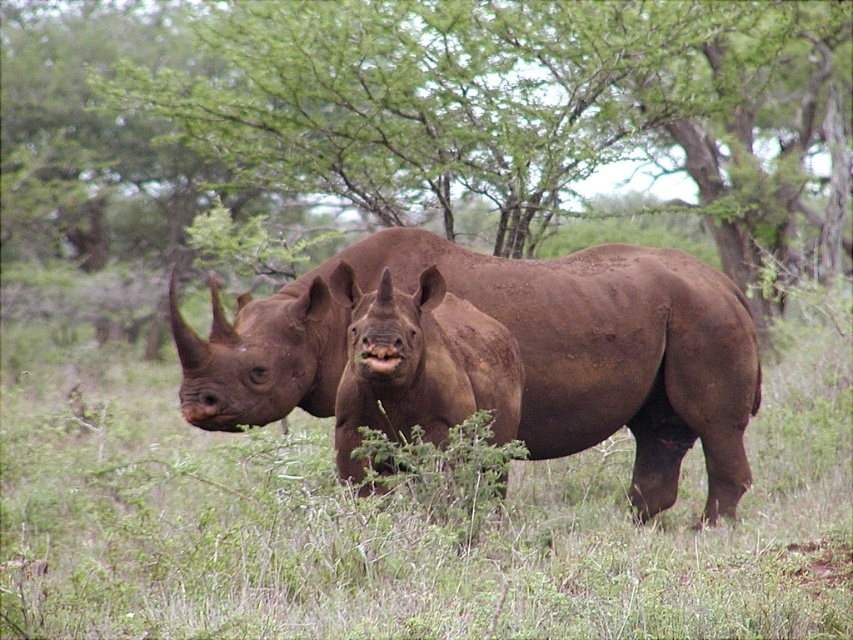
Looking at this image, you are a photographer trying to capture a photo of the matte brown rhino at center without the green leafy tree at center blocking the view. Based on their widths, do you think you can position yourself to the side of the tree and still see the rhino?

The green leafy tree at center might be wider than matte brown rhino at center, so positioning yourself to the side of the tree might still allow you to see the rhino if the tree is wider, but there is uncertainty due to the comparison being uncertain.

You are standing in the savanna and want to walk towards both the point at coordinates point (337, 380) and the point at coordinates point (514, 435). Which point will you reach first?

You will reach point (337, 380) first because it is closer to you than point (514, 435), which is further away.

You are a wildlife photographer aiming to capture a photo of the matte brown rhino at center. You need to position yourself exactly 10 meters away from it. Can you determine if you can stand behind the green leafy tree at center and still be within the required distance?

The distance between the green leafy tree at center and the matte brown rhino at center is 8.12 meters. If you stand behind the green leafy tree at center, you would be at least 8.12 meters away from the matte brown rhino at center. Since 8.12 meters is less than 10 meters, you can position yourself there and still be within the required distance.